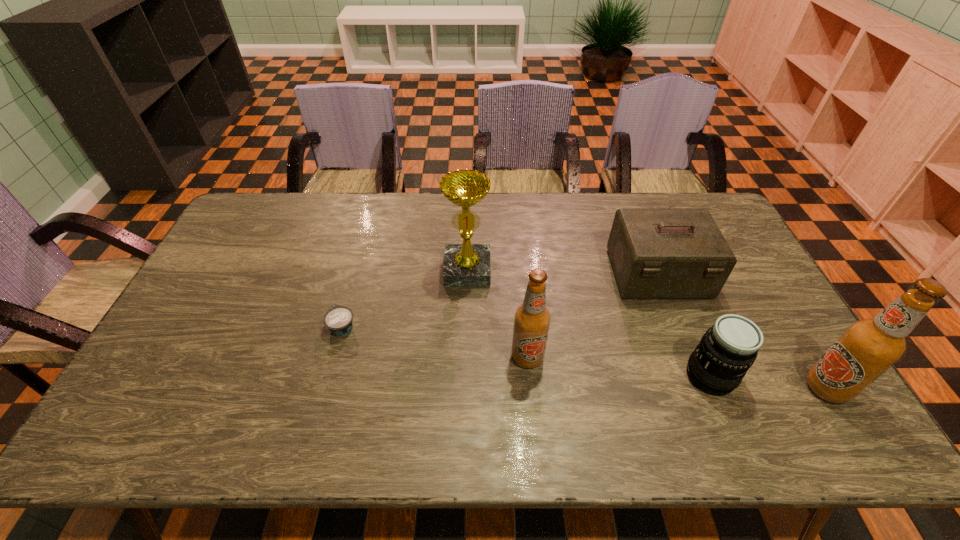
I want to click on free spot between the fifth object from right to left and the leftmost object, so click(405, 299).

The image size is (960, 540). In order to click on free space between the shortest object and the first-aid kit in this screenshot , I will do `click(500, 300)`.

Identify the location of free space between the first-aid kit and the shorter beer bottle. The width and height of the screenshot is (960, 540). (592, 315).

At what (x,y) coordinates should I click in order to perform the action: click on the closest object relative to the right beer bottle. Please return your answer as a coordinate pair (x, y). The image size is (960, 540). Looking at the image, I should click on (727, 350).

Find the location of a particular element. the closest object to the leftmost object is located at coordinates (465, 265).

Identify the location of free region that satisfies the following two spatial constraints: 1. on the front-facing side of the second object from left to right; 2. on the right side of the telephoto lens. (465, 376).

You are a GUI agent. You are given a task and a screenshot of the screen. Output one action in this format:
    pyautogui.click(x=<x>, y=<y>)
    Task: Click on the free space that satisfies the following two spatial constraints: 1. on the front-facing side of the telephoto lens; 2. on the left side of the award
    This screenshot has width=960, height=540.
    Given the screenshot: What is the action you would take?
    pyautogui.click(x=465, y=376)

Locate an element on the screen. This screenshot has height=540, width=960. free location that satisfies the following two spatial constraints: 1. on the front-facing side of the first-aid kit; 2. on the right side of the fifth object from right to left is located at coordinates (468, 274).

This screenshot has width=960, height=540. I want to click on vacant space that satisfies the following two spatial constraints: 1. on the back side of the shortest object; 2. on the left side of the first-aid kit, so click(x=357, y=274).

This screenshot has height=540, width=960. Find the location of `vacant space that satisfies the following two spatial constraints: 1. on the front label of the telephoto lens; 2. on the left side of the left beer bottle`. vacant space that satisfies the following two spatial constraints: 1. on the front label of the telephoto lens; 2. on the left side of the left beer bottle is located at coordinates (529, 376).